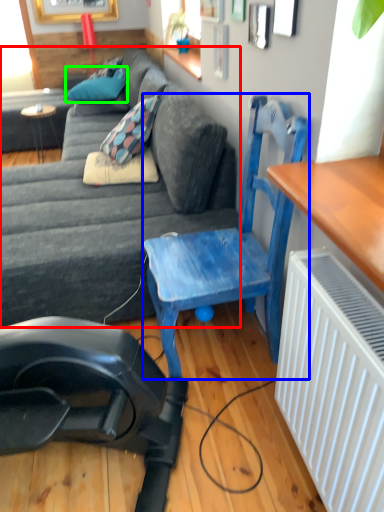
Question: Which object is the closest to the studio couch (highlighted by a red box)? Choose among these: chair (highlighted by a blue box) or pillow (highlighted by a green box).

Choices:
 (A) chair
 (B) pillow

Answer: (A)